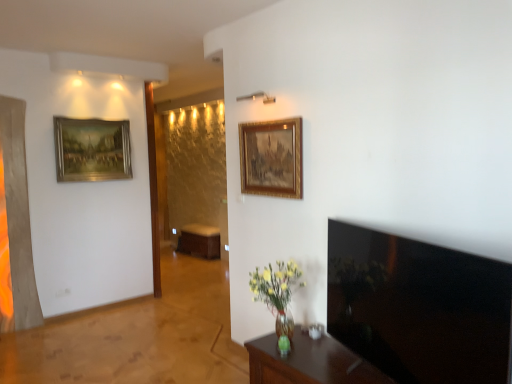
Question: Considering the relative positions of brown wooden table at lower right and gold-framed painting at upper left, placed as the 1th picture frame when sorted from back to front, in the image provided, is brown wooden table at lower right to the left of gold-framed painting at upper left, placed as the 1th picture frame when sorted from back to front, from the viewer's perspective?

Choices:
 (A) no
 (B) yes

Answer: (A)

Question: From a real-world perspective, is brown wooden table at lower right physically below gold-framed painting at upper left, placed as the 1th picture frame when sorted from back to front?

Choices:
 (A) yes
 (B) no

Answer: (A)

Question: Does brown wooden table at lower right come in front of gold-framed painting at upper left, marked as the 2th picture frame in a right-to-left arrangement?

Choices:
 (A) yes
 (B) no

Answer: (A)

Question: Is brown wooden table at lower right surrounding gold-framed painting at upper left, placed as the 1th picture frame when sorted from back to front?

Choices:
 (A) yes
 (B) no

Answer: (B)

Question: From the image's perspective, does brown wooden table at lower right appear lower than gold-framed painting at upper left, the second picture frame from the front?

Choices:
 (A) no
 (B) yes

Answer: (B)

Question: From the image's perspective, relative to brown wooden table at center, is brown wooden table at lower right above or below?

Choices:
 (A) below
 (B) above

Answer: (A)

Question: From a real-world perspective, is brown wooden table at lower right above or below brown wooden table at center?

Choices:
 (A) above
 (B) below

Answer: (B)

Question: Is brown wooden table at lower right taller or shorter than brown wooden table at center?

Choices:
 (A) short
 (B) tall

Answer: (A)

Question: Considering the positions of brown wooden table at lower right and brown wooden table at center in the image, is brown wooden table at lower right bigger or smaller than brown wooden table at center?

Choices:
 (A) small
 (B) big

Answer: (A)

Question: Would you say black glossy tv at right is to the left or to the right of brown wooden table at center in the picture?

Choices:
 (A) right
 (B) left

Answer: (A)

Question: Is black glossy tv at right wider or thinner than brown wooden table at center?

Choices:
 (A) thin
 (B) wide

Answer: (A)

Question: In terms of size, does black glossy tv at right appear bigger or smaller than brown wooden table at center?

Choices:
 (A) small
 (B) big

Answer: (A)

Question: Considering their positions, is black glossy tv at right located in front of or behind brown wooden table at center?

Choices:
 (A) behind
 (B) front

Answer: (B)

Question: In terms of size, does gold-framed painting at upper left, marked as the 2th picture frame in a right-to-left arrangement, appear bigger or smaller than brown wooden table at center?

Choices:
 (A) big
 (B) small

Answer: (B)

Question: From the image's perspective, is gold-framed painting at upper left, the 1th picture frame viewed from the left, located above or below brown wooden table at center?

Choices:
 (A) below
 (B) above

Answer: (B)